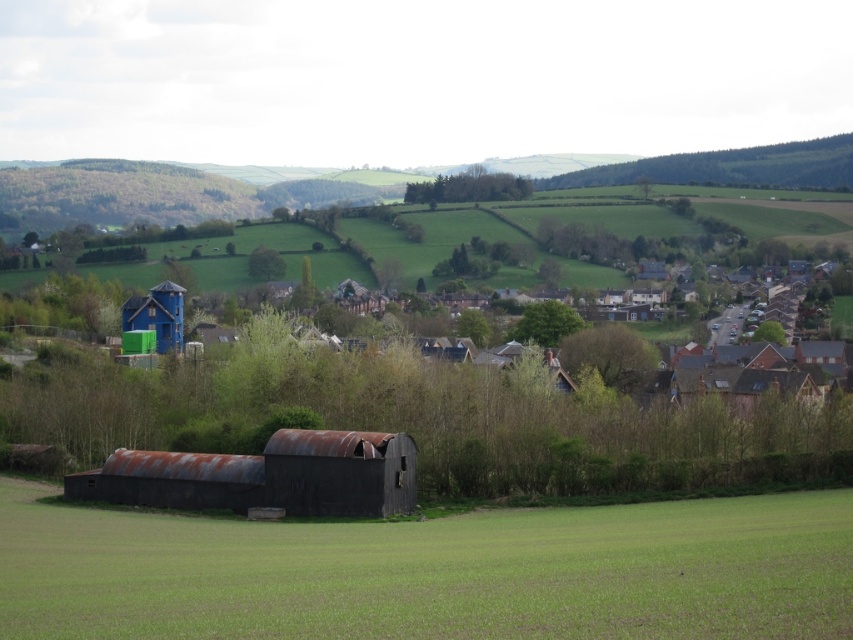
You are standing at the edge of the green grassy field at lower center and want to walk towards the blue painted wood hut at upper left. Which direction should you head to reach the hut?

You should head north because the blue painted wood hut at upper left is located north of the green grassy field at lower center.

You are a drone operator trying to capture aerial footage of the rusty metal barn at lower center and the blue painted wood hut at upper left. Based on their heights, which structure should you fly closer to first to ensure both are visible in the same frame?

The rusty metal barn at lower center is not as tall as the blue painted wood hut at upper left. To ensure both are visible in the same frame, you should fly closer to the rusty metal barn at lower center first, as it is shorter and requires a lower altitude for proper framing.

From the picture: You are a photographer planning to capture the rusty metal barn at lower center and the rusty metal hut at center in a single shot. Given that the barn is taller, how might its height affect the composition of your photo?

The rusty metal barn at lower center is much taller than the rusty metal hut at center, so positioning the barn in the foreground or background will influence the perspective and scale of the scene in your photo.